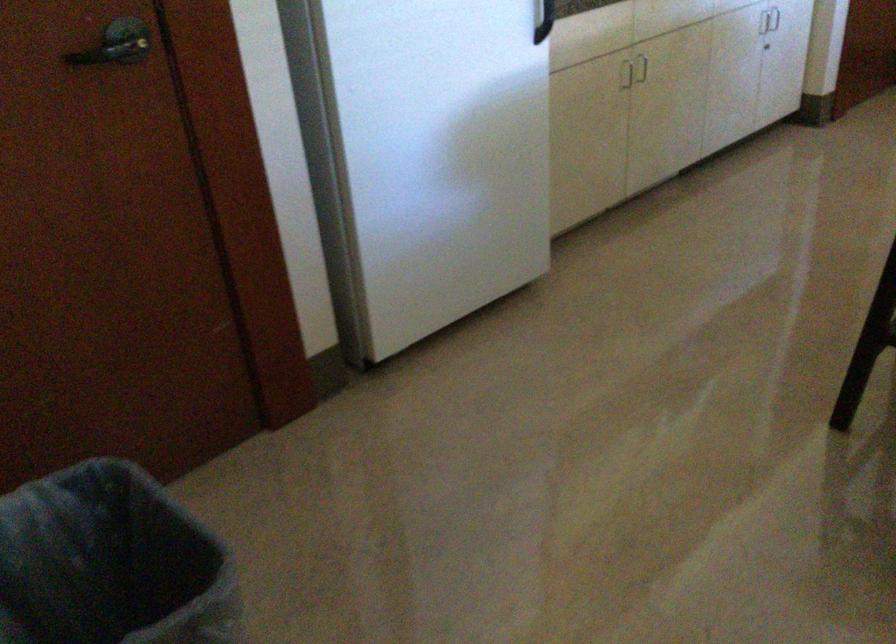
In order to click on gray trash can in this screenshot , I will do `click(110, 563)`.